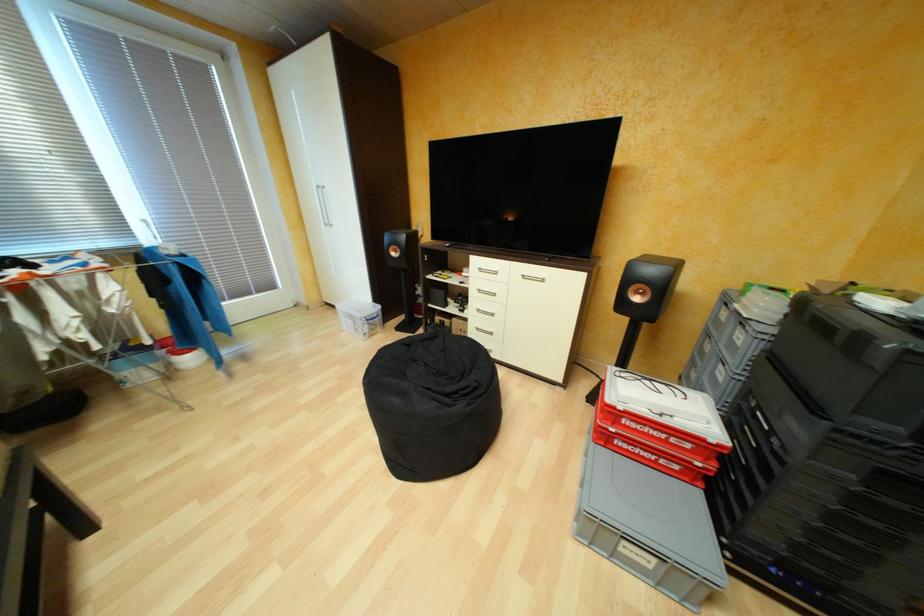
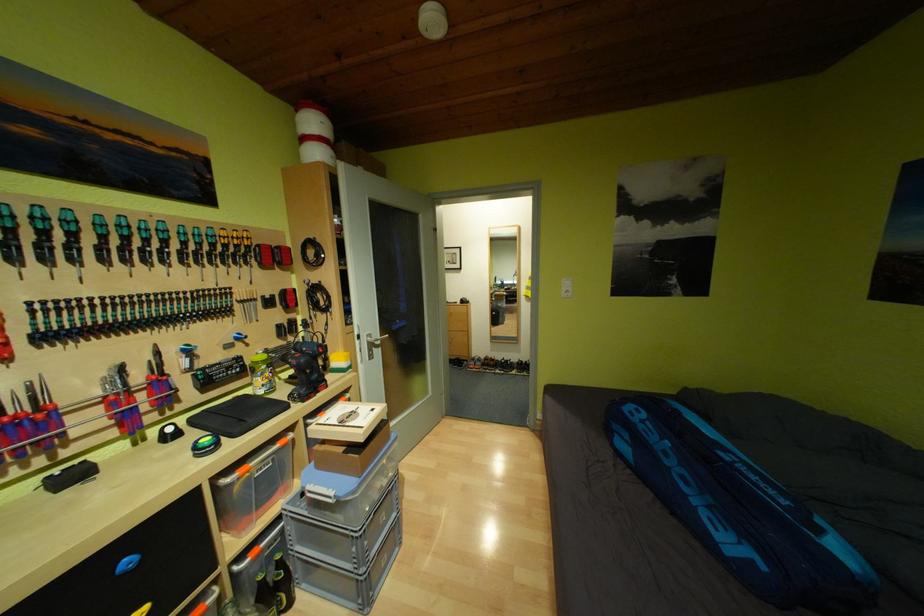
Question: I am providing you with two images of the same scene from different viewpoints. After the viewpoint changes to image2, which objects are now occluded?

Choices:
 (A) cardboard box
 (B) sofa sitting surface
 (C) white gaming peripheral
 (D) white wardrobe handle

Answer: (D)